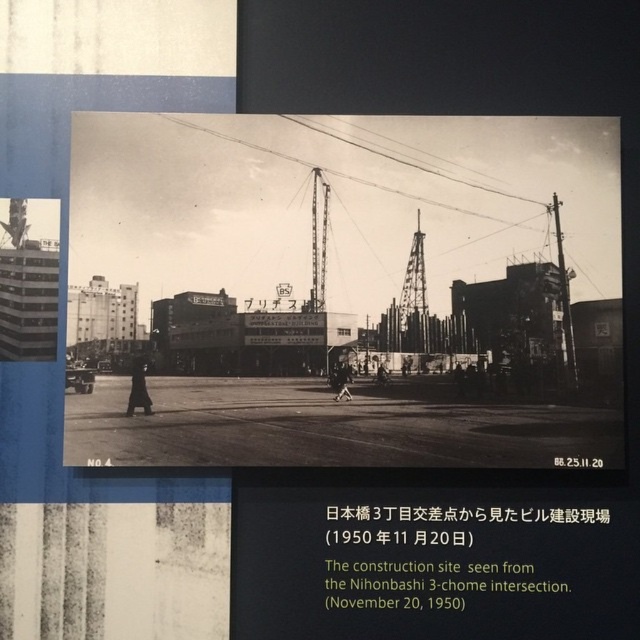
Based on the scene description, where is the metallic tower at center located in the image?

The metallic tower at center is located at the point with coordinates (413, 298) in the image.

You are a construction worker who needs to move a 20 inch long steel beam from the metallic tower at center to the metallic construction crane at center. Can you move it without bending the beam?

The distance between the metallic tower at center and the metallic construction crane at center is 19.32 inches, so the steel beam can be moved without bending since it is shorter than the beam length.

You are standing at the Nihonbashi 3 Chome intersection in 1950 and see two points in the scene. The first point is at coordinates point (412, 246) and the second is at point (321, 300). Which point is closer to you?

Point (412, 246) is closer to the viewer than point (321, 300).